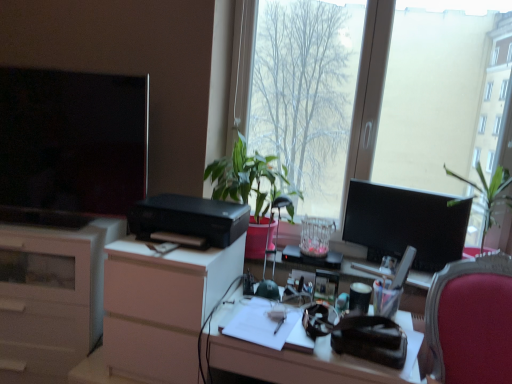
Where is `blank space above white paper at center (from a real-world perspective)`? This screenshot has width=512, height=384. blank space above white paper at center (from a real-world perspective) is located at coordinates (268, 318).